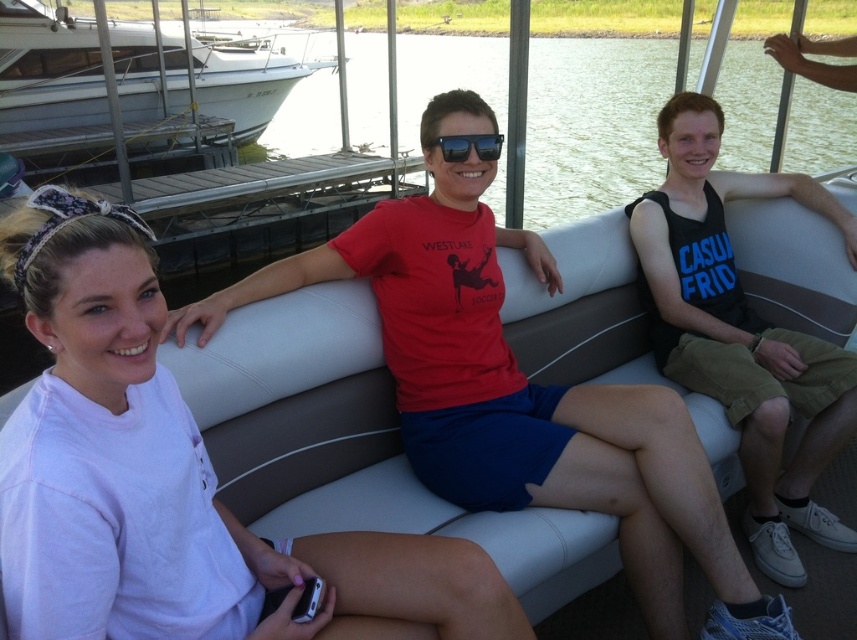
You are on a pontoon boat and need to place a cooler between the person wearing a light pink long sleeve shirt and the person in the black tank top at right. Based on their positions, where should you place the cooler?

The cooler should be placed between the person wearing a light pink long sleeve shirt and the black tank top at right, closer to the black tank top at right since it is located at point (742, 332) which is further to the right compared to the others.